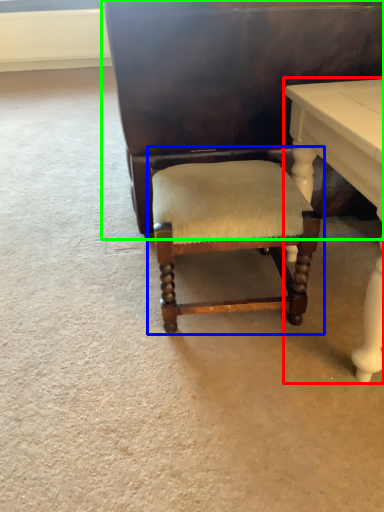
Question: Which is farther away from table (highlighted by a red box)? chair (highlighted by a blue box) or vanity (highlighted by a green box)?

Choices:
 (A) chair
 (B) vanity

Answer: (B)